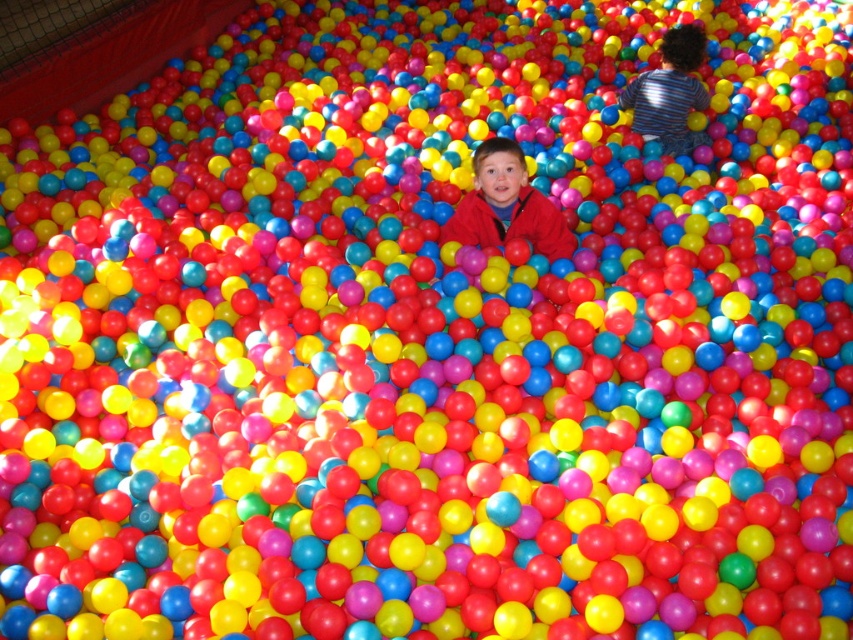
Can you confirm if matte red jacket at center is wider than striped cotton shirt at center?

Indeed, matte red jacket at center has a greater width compared to striped cotton shirt at center.

Does point (509, 204) come behind point (688, 52)?

No.

Is point (483, 173) less distant than point (672, 109)?

Yes.

Find the location of `matte red jacket at center`. matte red jacket at center is located at coordinates (508, 205).